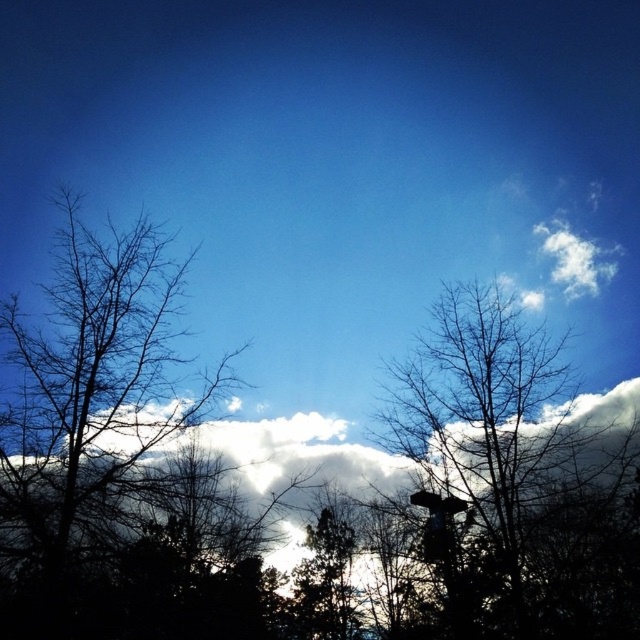
Question: Is black bare tree at left positioned behind bare branches at center?

Choices:
 (A) no
 (B) yes

Answer: (A)

Question: Which object is farther from the camera taking this photo?

Choices:
 (A) bare branches at center
 (B) black bare tree at left

Answer: (A)

Question: Is black bare tree at left to the right of bare branches at center from the viewer's perspective?

Choices:
 (A) no
 (B) yes

Answer: (A)

Question: Does black bare tree at left appear under bare branches at center?

Choices:
 (A) no
 (B) yes

Answer: (A)